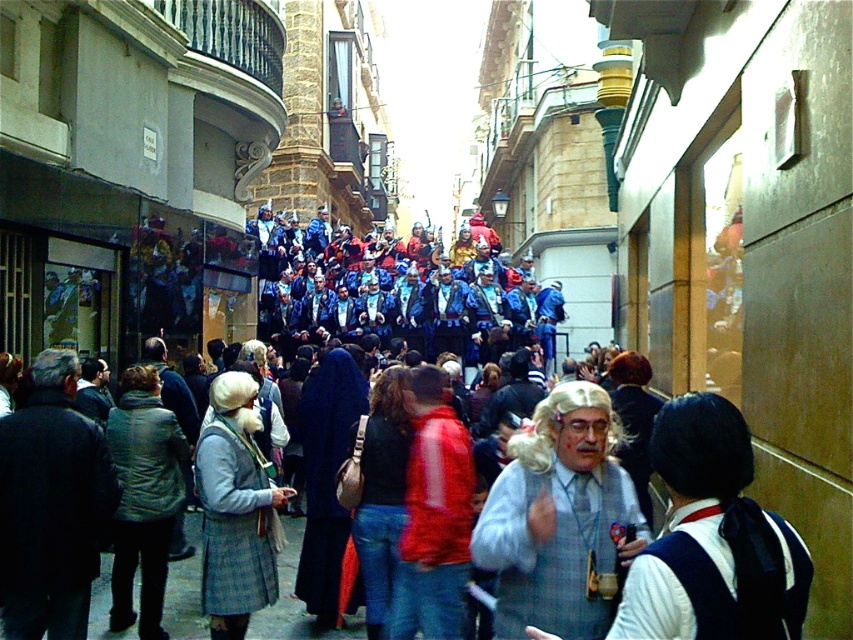
Which is above, blue fabric crowd at center or white curly wig at center?

blue fabric crowd at center is above.

Looking at this image, who is positioned more to the right, blue fabric crowd at center or white curly wig at center?

white curly wig at center

Is point (177, 426) positioned behind point (560, 481)?

Yes, it is behind point (560, 481).

Where is `blue fabric crowd at center`? blue fabric crowd at center is located at coordinates (322, 451).